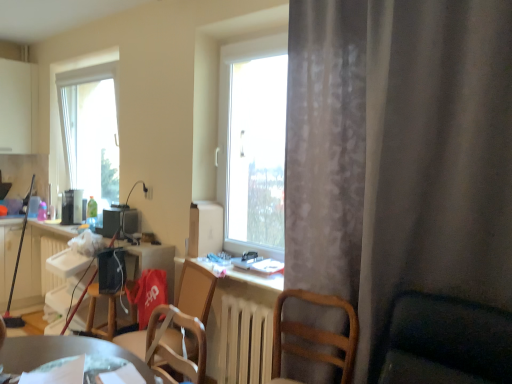
Question: Is gray sheer curtain at right completely or partially outside of transparent glass window at left?

Choices:
 (A) no
 (B) yes

Answer: (B)

Question: Is gray sheer curtain at right facing away from transparent glass window at left?

Choices:
 (A) no
 (B) yes

Answer: (A)

Question: Is gray sheer curtain at right thinner than transparent glass window at left?

Choices:
 (A) no
 (B) yes

Answer: (A)

Question: Does gray sheer curtain at right have a greater width compared to transparent glass window at left?

Choices:
 (A) no
 (B) yes

Answer: (B)

Question: From the image's perspective, is gray sheer curtain at right on transparent glass window at left?

Choices:
 (A) no
 (B) yes

Answer: (A)

Question: From a real-world perspective, is white cardboard box at center, placed as the 3th appliance when sorted from back to front, physically located above or below metallic silver desk at lower center?

Choices:
 (A) below
 (B) above

Answer: (B)

Question: Is white cardboard box at center, which is the third appliance from left to right, taller or shorter than metallic silver desk at lower center?

Choices:
 (A) short
 (B) tall

Answer: (B)

Question: Considering their positions, is white cardboard box at center, placed as the 3th appliance when sorted from back to front, located in front of or behind metallic silver desk at lower center?

Choices:
 (A) behind
 (B) front

Answer: (A)

Question: Is white cardboard box at center, which is the third appliance from left to right, spatially inside metallic silver desk at lower center, or outside of it?

Choices:
 (A) outside
 (B) inside

Answer: (A)

Question: From a real-world perspective, is wooden chair at center, the 1th chair positioned from the left, above or below green glass bottle at center?

Choices:
 (A) above
 (B) below

Answer: (B)

Question: From the image's perspective, relative to green glass bottle at center, is wooden chair at center, the 1th chair positioned from the left, above or below?

Choices:
 (A) below
 (B) above

Answer: (A)

Question: Considering the positions of wooden chair at center, the 1th chair positioned from the left, and green glass bottle at center in the image, is wooden chair at center, the 1th chair positioned from the left, wider or thinner than green glass bottle at center?

Choices:
 (A) wide
 (B) thin

Answer: (A)

Question: Would you say wooden chair at center, the 1th chair positioned from the left, is inside or outside green glass bottle at center?

Choices:
 (A) inside
 (B) outside

Answer: (B)

Question: From their relative heights in the image, would you say transparent glass window at left is taller or shorter than matte black computer desk at left?

Choices:
 (A) tall
 (B) short

Answer: (A)

Question: From the image's perspective, is transparent glass window at left above or below matte black computer desk at left?

Choices:
 (A) above
 (B) below

Answer: (A)